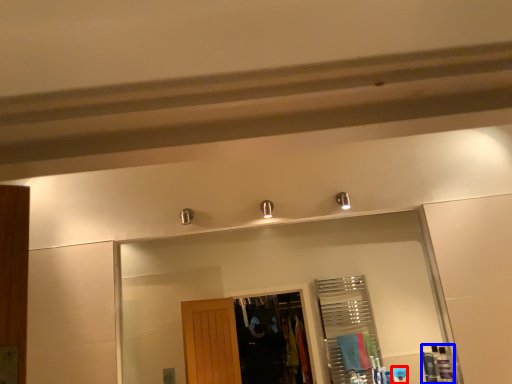
Question: Among these objects, which one is nearest to the camera, toiletry (highlighted by a red box) or toiletry (highlighted by a blue box)?

Choices:
 (A) toiletry
 (B) toiletry

Answer: (B)